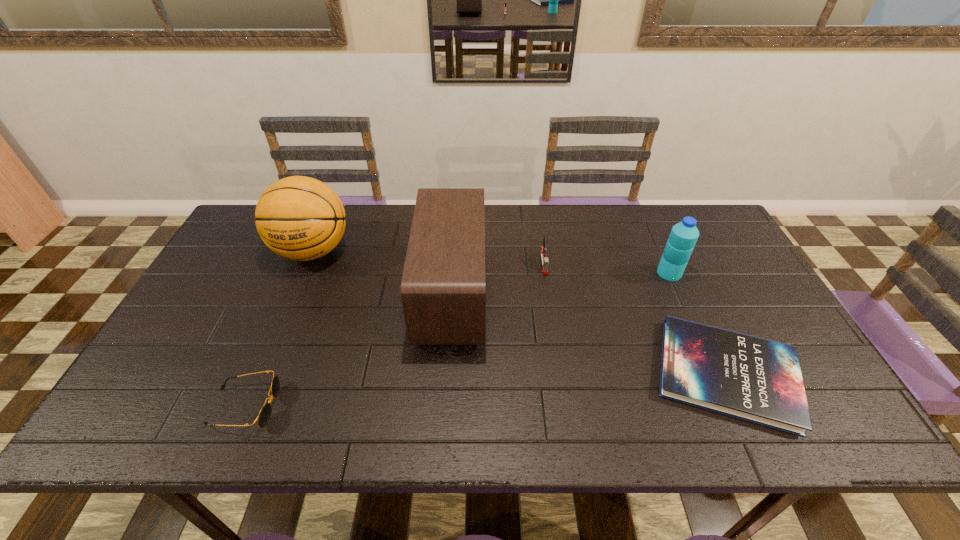
In order to click on basketball in this screenshot , I will do `click(300, 218)`.

This screenshot has height=540, width=960. Identify the location of radio receiver. (443, 284).

Locate an element on the screen. This screenshot has height=540, width=960. water bottle is located at coordinates (682, 239).

The image size is (960, 540). I want to click on stapler, so click(x=543, y=252).

Find the location of a particular element. The width and height of the screenshot is (960, 540). the third object from right to left is located at coordinates (543, 252).

This screenshot has width=960, height=540. In order to click on sunglasses in this screenshot , I will do `click(264, 415)`.

The height and width of the screenshot is (540, 960). I want to click on the shortest object, so click(758, 380).

Identify the location of vacant space situated 0.060m on the surface of the basketball near the brand logo. (295, 293).

The height and width of the screenshot is (540, 960). What are the coordinates of `vacant region located on the front-facing side of the radio receiver` in the screenshot? It's located at click(600, 293).

Image resolution: width=960 pixels, height=540 pixels. I want to click on free space located 0.380m on the left of the fourth shortest object, so click(530, 273).